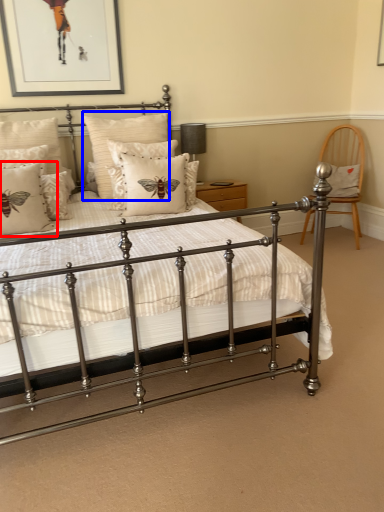
Question: Which point is further to the camera, pillow (highlighted by a red box) or pillow (highlighted by a blue box)?

Choices:
 (A) pillow
 (B) pillow

Answer: (B)